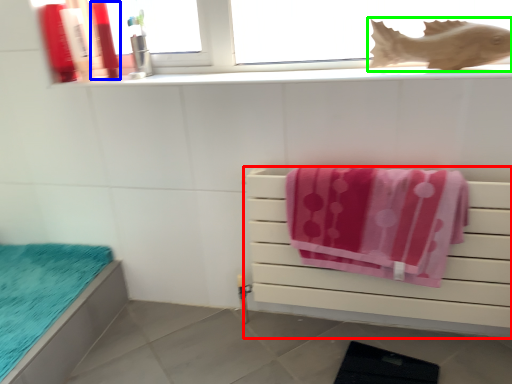
Question: Estimate the real-world distances between objects in this image. Which object is farther from furniture (highlighted by a red box), toiletry (highlighted by a blue box) or fish (highlighted by a green box)?

Choices:
 (A) toiletry
 (B) fish

Answer: (A)